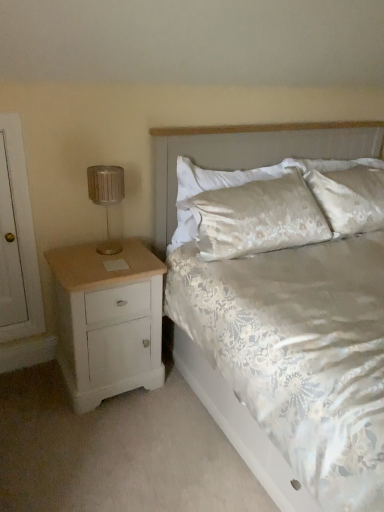
Question: Is satin fabric headboard at upper center turned away from metallic silver lamp at left?

Choices:
 (A) yes
 (B) no

Answer: (B)

Question: Does satin fabric headboard at upper center have a larger size compared to metallic silver lamp at left?

Choices:
 (A) yes
 (B) no

Answer: (A)

Question: From the image's perspective, is satin fabric headboard at upper center below metallic silver lamp at left?

Choices:
 (A) no
 (B) yes

Answer: (B)

Question: Does satin fabric headboard at upper center have a lesser width compared to metallic silver lamp at left?

Choices:
 (A) yes
 (B) no

Answer: (B)

Question: Is satin fabric headboard at upper center further to the viewer compared to metallic silver lamp at left?

Choices:
 (A) yes
 (B) no

Answer: (B)

Question: Which is correct: satin fabric headboard at upper center is inside silky white pillow at upper center, or outside of it?

Choices:
 (A) outside
 (B) inside

Answer: (A)

Question: Is satin fabric headboard at upper center bigger or smaller than silky white pillow at upper center?

Choices:
 (A) big
 (B) small

Answer: (A)

Question: Is satin fabric headboard at upper center in front of or behind silky white pillow at upper center in the image?

Choices:
 (A) front
 (B) behind

Answer: (A)

Question: Considering the positions of satin fabric headboard at upper center and silky white pillow at upper center in the image, is satin fabric headboard at upper center taller or shorter than silky white pillow at upper center?

Choices:
 (A) tall
 (B) short

Answer: (A)

Question: Is white floral fabric bed at center bigger or smaller than white painted wood nightstand at left?

Choices:
 (A) small
 (B) big

Answer: (B)

Question: From a real-world perspective, is white floral fabric bed at center physically located above or below white painted wood nightstand at left?

Choices:
 (A) above
 (B) below

Answer: (A)

Question: Is point (332, 156) closer or farther from the camera than point (94, 354)?

Choices:
 (A) closer
 (B) farther

Answer: (B)

Question: From their relative heights in the image, would you say white floral fabric bed at center is taller or shorter than white painted wood nightstand at left?

Choices:
 (A) short
 (B) tall

Answer: (B)

Question: From their relative heights in the image, would you say white floral fabric bed at center is taller or shorter than satin fabric headboard at upper center?

Choices:
 (A) tall
 (B) short

Answer: (A)

Question: Is point (158, 248) closer or farther from the camera than point (201, 133)?

Choices:
 (A) closer
 (B) farther

Answer: (B)